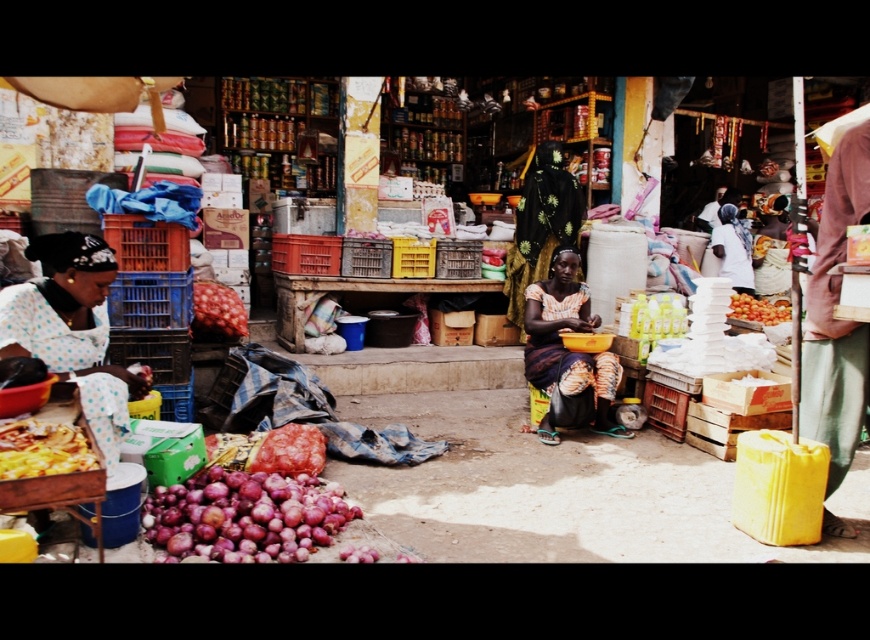
You are a customer at the market and want to pick up the golden crispy pizza at lower left. Is the polka dot fabric at left in your way?

The polka dot fabric at left is above the golden crispy pizza at lower left, so it is not blocking your path. You can easily reach the golden crispy pizza at lower left without moving the fabric.

You are a customer at the market and see the polka dot fabric at left and the golden crispy pizza at lower left. Which item is positioned higher up compared to the other?

The polka dot fabric at left is much taller than the golden crispy pizza at lower left, so it is positioned higher up.

You are a food vendor at the market and need to stack the golden crispy pizza at lower left and the smooth red onion at center on a shelf. Which item should you place at the bottom to ensure stability?

The smooth red onion at center is taller than the golden crispy pizza at lower left, so you should place the smooth red onion at center at the bottom to ensure stability.